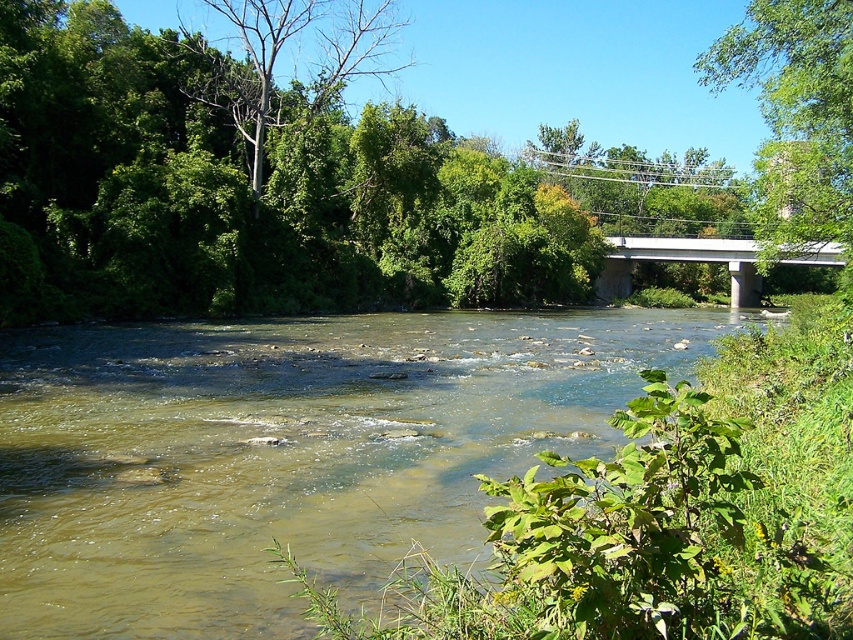
You are a hiker planning to cross the river using the white concrete bridge at upper center. However, you notice the brown sedimentary stream at center flowing nearby. Which direction should you adjust your path to avoid the stream?

The brown sedimentary stream at center is to the left of the white concrete bridge at upper center, so you should adjust your path to the right to avoid it.

You are standing on the bank of the river and want to cross to the other side. The white concrete bridge at upper center is your only option. However, the brown sedimentary stream at center is in the way. Can you walk directly to the bridge without stepping into the stream?

The brown sedimentary stream at center is closer to the viewer than the white concrete bridge at upper center, so you would have to step over or around the stream before reaching the bridge.

You are standing on the concrete bridge with a metal railing on the right side of the image. Looking down at the river below, you notice a point marked at coordinates (286, 452). What is located at this point?

The point at coordinates (286, 452) indicates a brown sedimentary stream at center.